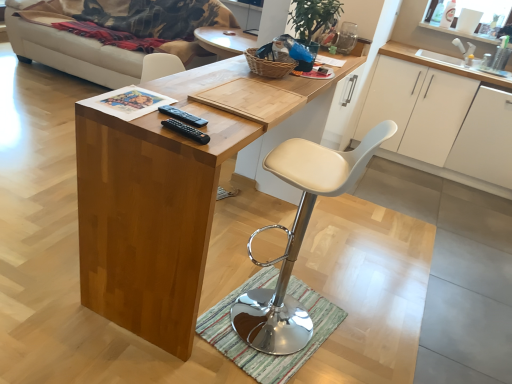
Locate an element on the screen. The width and height of the screenshot is (512, 384). striped fabric doormat at lower center is located at coordinates (259, 351).

You are a GUI agent. You are given a task and a screenshot of the screen. Output one action in this format:
    pyautogui.click(x=<x>, y=<y>)
    Task: Click on the beige fabric couch at upper left
    The height and width of the screenshot is (384, 512).
    Given the screenshot: What is the action you would take?
    pyautogui.click(x=116, y=32)

What is the approximate height of black plastic remote at center?

black plastic remote at center is 0.89 inches tall.

The height and width of the screenshot is (384, 512). Describe the element at coordinates (437, 63) in the screenshot. I see `white matte cabinet at upper right, acting as the first cabinetry starting from the left` at that location.

What is the approximate height of wooden desk at center?

36.49 inches.

The image size is (512, 384). I want to click on white leather stool at center, so click(298, 238).

The image size is (512, 384). I want to click on striped fabric doormat at lower center, so click(x=259, y=351).

From a real-world perspective, is white leather stool at center positioned above or below white matte cabinet at upper right, acting as the first cabinetry starting from the left?

From a real-world perspective, white leather stool at center is physically above white matte cabinet at upper right, acting as the first cabinetry starting from the left.

This screenshot has height=384, width=512. In order to click on chair above the white matte cabinet at upper right, acting as the first cabinetry starting from the left (from a real-world perspective) in this screenshot , I will do `click(298, 238)`.

Between white leather stool at center and white matte cabinet at upper right, acting as the first cabinetry starting from the left, which one has smaller width?

white leather stool at center is thinner.

Looking at this image, would you say white leather stool at center is to the left or to the right of white matte cabinet at upper right, acting as the first cabinetry starting from the left, in the picture?

From the image, it's evident that white leather stool at center is to the left of white matte cabinet at upper right, acting as the first cabinetry starting from the left.

Can you confirm if white matte cabinet at upper right, acting as the first cabinetry starting from the left, is positioned to the left of white leather stool at center?

Incorrect, white matte cabinet at upper right, acting as the first cabinetry starting from the left, is not on the left side of white leather stool at center.

Which is closer, (416, 162) or (285, 156)?

The point (285, 156) is closer.

Is the position of white matte cabinet at upper right, acting as the first cabinetry starting from the left, more distant than that of white leather stool at center?

Yes, white matte cabinet at upper right, acting as the first cabinetry starting from the left, is further from the viewer.

From the image's perspective, which one is positioned higher, white matte cabinet at upper right, acting as the first cabinetry starting from the left, or white leather stool at center?

white matte cabinet at upper right, acting as the first cabinetry starting from the left.

Considering the relative sizes of black plastic remote at center and wooden desk at center in the image provided, is black plastic remote at center shorter than wooden desk at center?

Indeed, black plastic remote at center has a lesser height compared to wooden desk at center.

Is black plastic remote at center oriented towards wooden desk at center?

Yes, black plastic remote at center is turned towards wooden desk at center.

Would you say black plastic remote at center contains wooden desk at center?

No, wooden desk at center is not inside black plastic remote at center.

The width and height of the screenshot is (512, 384). I want to click on remote above the wooden desk at center (from a real-world perspective), so click(x=182, y=116).

Does beige fabric couch at upper left have a smaller size compared to white matte cabinet at upper right, acting as the first cabinetry starting from the left?

No, beige fabric couch at upper left is not smaller than white matte cabinet at upper right, acting as the first cabinetry starting from the left.

Is beige fabric couch at upper left located outside white matte cabinet at upper right, acting as the first cabinetry starting from the left?

beige fabric couch at upper left is positioned outside white matte cabinet at upper right, acting as the first cabinetry starting from the left.

From the image's perspective, would you say beige fabric couch at upper left is shown under white matte cabinet at upper right, which is the second cabinetry in right-to-left order?

No, from the image's perspective, beige fabric couch at upper left is not beneath white matte cabinet at upper right, which is the second cabinetry in right-to-left order.

Image resolution: width=512 pixels, height=384 pixels. Find the location of `the 1st cabinetry counting from the right side of the beige fabric couch at upper left`. the 1st cabinetry counting from the right side of the beige fabric couch at upper left is located at coordinates (437, 63).

Is white leather stool at center not near striped fabric doormat at lower center?

They are positioned close to each other.

Does point (276, 339) come closer to viewer compared to point (258, 359)?

No, (276, 339) is behind (258, 359).

Locate an element on the screen. The height and width of the screenshot is (384, 512). chair lying in front of the striped fabric doormat at lower center is located at coordinates (298, 238).

From the image's perspective, relative to striped fabric doormat at lower center, is white leather stool at center above or below?

white leather stool at center is situated higher than striped fabric doormat at lower center in the image.

Which object is positioned more to the right, black plastic remote at center or white matte cabinet at upper right, which is the second cabinetry in right-to-left order?

From the viewer's perspective, white matte cabinet at upper right, which is the second cabinetry in right-to-left order, appears more on the right side.

From their relative heights in the image, would you say black plastic remote at center is taller or shorter than white matte cabinet at upper right, which is the second cabinetry in right-to-left order?

In the image, black plastic remote at center appears to be shorter than white matte cabinet at upper right, which is the second cabinetry in right-to-left order.

Considering the sizes of objects black plastic remote at center and white matte cabinet at upper right, which is the second cabinetry in right-to-left order, in the image provided, who is smaller, black plastic remote at center or white matte cabinet at upper right, which is the second cabinetry in right-to-left order,?

With smaller size is black plastic remote at center.

From a real-world perspective, is black plastic remote at center positioned under white matte cabinet at upper right, which is the second cabinetry in right-to-left order, based on gravity?

No, from a real-world perspective, black plastic remote at center is not under white matte cabinet at upper right, which is the second cabinetry in right-to-left order.

From a real-world perspective, does striped fabric doormat at lower center sit lower than white matte cabinet at upper right, which is the second cabinetry in right-to-left order?

Yes, from a real-world perspective, striped fabric doormat at lower center is under white matte cabinet at upper right, which is the second cabinetry in right-to-left order.

Considering their positions, is striped fabric doormat at lower center located in front of or behind white matte cabinet at upper right, acting as the first cabinetry starting from the left?

Visually, striped fabric doormat at lower center is located in front of white matte cabinet at upper right, acting as the first cabinetry starting from the left.

Measure the distance from striped fabric doormat at lower center to white matte cabinet at upper right, acting as the first cabinetry starting from the left.

They are 8.15 feet apart.

Considering the sizes of objects striped fabric doormat at lower center and white matte cabinet at upper right, acting as the first cabinetry starting from the left, in the image provided, who is taller, striped fabric doormat at lower center or white matte cabinet at upper right, acting as the first cabinetry starting from the left,?

Standing taller between the two is white matte cabinet at upper right, acting as the first cabinetry starting from the left.

There is a white leather stool at center. Identify the location of the 2nd cabinetry above it (from the image's perspective). (437, 63).

The image size is (512, 384). Identify the location of cabinetry that is the 1st object to the right of the white leather stool at center, starting at the anchor. (437, 63).

Estimate the real-world distances between objects in this image. Which object is further from striped fabric doormat at lower center, beige fabric couch at upper left or wooden desk at center?

beige fabric couch at upper left lies further to striped fabric doormat at lower center than the other object.

Considering their positions, is white matte cabinet at right, marked as the first cabinetry in a right-to-left arrangement, positioned further to striped fabric doormat at lower center than black plastic remote at center?

white matte cabinet at right, marked as the first cabinetry in a right-to-left arrangement, lies further to striped fabric doormat at lower center than the other object.

Estimate the real-world distances between objects in this image. Which object is closer to black plastic remote at center, white matte cabinet at right, marked as the first cabinetry in a right-to-left arrangement, or wooden desk at center?

Based on the image, wooden desk at center appears to be nearer to black plastic remote at center.

Estimate the real-world distances between objects in this image. Which object is closer to white matte cabinet at upper right, which is the second cabinetry in right-to-left order, white leather stool at center or beige fabric couch at upper left?

white leather stool at center.

Estimate the real-world distances between objects in this image. Which object is further from white matte cabinet at upper right, acting as the first cabinetry starting from the left, black plastic remote at center or striped fabric doormat at lower center?

The object further to white matte cabinet at upper right, acting as the first cabinetry starting from the left, is black plastic remote at center.

Which object lies further to the anchor point white leather stool at center, beige fabric couch at upper left or wooden desk at center?

The object further to white leather stool at center is beige fabric couch at upper left.

Which object lies nearer to the anchor point white matte cabinet at upper right, which is the second cabinetry in right-to-left order, white matte cabinet at right, marked as the first cabinetry in a right-to-left arrangement, or white leather stool at center?

white matte cabinet at right, marked as the first cabinetry in a right-to-left arrangement.

Considering their positions, is black plastic remote at center positioned closer to white matte cabinet at upper right, acting as the first cabinetry starting from the left, than wooden desk at center?

Among the two, wooden desk at center is located nearer to white matte cabinet at upper right, acting as the first cabinetry starting from the left.

This screenshot has width=512, height=384. Find the location of `cabinetry located between wooden desk at center and white matte cabinet at right, marked as the first cabinetry in a right-to-left arrangement, in the left-right direction`. cabinetry located between wooden desk at center and white matte cabinet at right, marked as the first cabinetry in a right-to-left arrangement, in the left-right direction is located at coordinates (437, 63).

At what (x,y) coordinates should I click in order to perform the action: click on remote between beige fabric couch at upper left and striped fabric doormat at lower center in the up-down direction. Please return your answer as a coordinate pair (x, y). The height and width of the screenshot is (384, 512). Looking at the image, I should click on (182, 116).

The width and height of the screenshot is (512, 384). I want to click on desk that lies between black plastic remote at center and striped fabric doormat at lower center from top to bottom, so click(153, 208).

Image resolution: width=512 pixels, height=384 pixels. I want to click on chair between beige fabric couch at upper left and striped fabric doormat at lower center from top to bottom, so click(x=298, y=238).